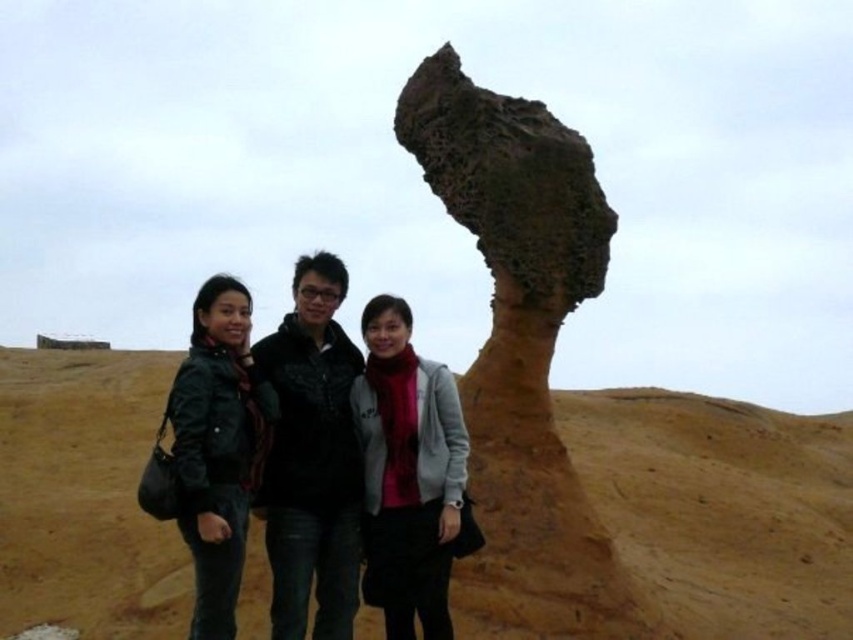
Which of these two, matte black jacket at center or leather jacket at center, stands taller?

Standing taller between the two is matte black jacket at center.

Is matte black jacket at center wider than leather jacket at center?

Yes, matte black jacket at center is wider than leather jacket at center.

Which is behind, point (335, 500) or point (250, 403)?

The point (250, 403) is more distant.

I want to click on matte black jacket at center, so click(x=276, y=456).

Which of these two, brown sandy desert at center or black matte jacket at center, stands shorter?

brown sandy desert at center

Describe the element at coordinates (721, 508) in the screenshot. I see `brown sandy desert at center` at that location.

Is point (838, 522) farther from camera compared to point (288, 465)?

Yes.

At what (x,y) coordinates should I click in order to perform the action: click on brown sandy desert at center. Please return your answer as a coordinate pair (x, y). Image resolution: width=853 pixels, height=640 pixels. Looking at the image, I should click on (721, 508).

Is matte black jacket at center smaller than matte gray scarf at center?

Incorrect, matte black jacket at center is not smaller in size than matte gray scarf at center.

Who is positioned more to the left, matte black jacket at center or matte gray scarf at center?

Positioned to the left is matte black jacket at center.

The width and height of the screenshot is (853, 640). What do you see at coordinates (276, 456) in the screenshot? I see `matte black jacket at center` at bounding box center [276, 456].

In order to click on matte black jacket at center in this screenshot , I will do `click(276, 456)`.